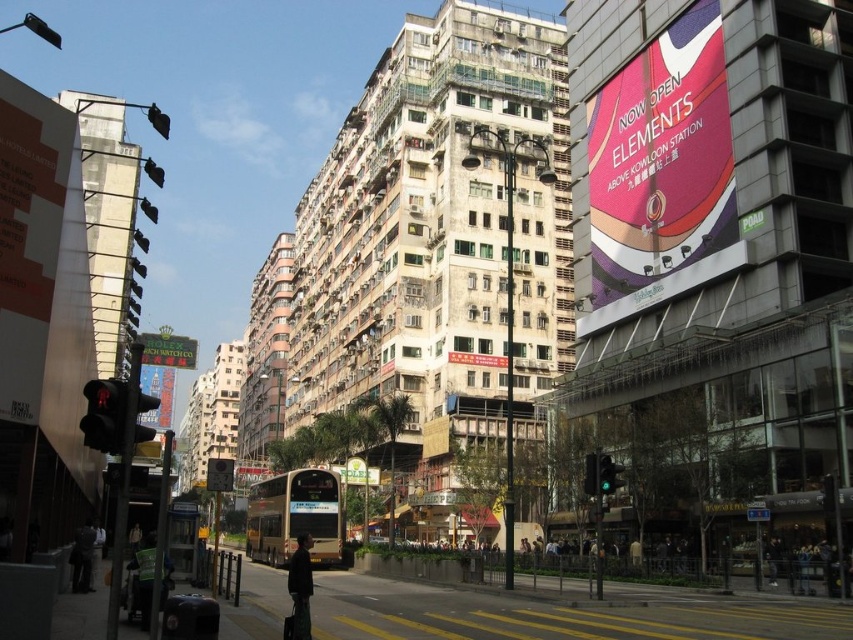
Is matte black traffic light at left above green glass traffic light at center?

Yes.

Is point (86, 424) in front of point (610, 474)?

Yes, it is in front of point (610, 474).

The height and width of the screenshot is (640, 853). Find the location of `matte black traffic light at left`. matte black traffic light at left is located at coordinates (103, 413).

Which is above, matte pink signboard at upper right or metallic gold sign at left?

matte pink signboard at upper right

Can you confirm if matte pink signboard at upper right is positioned above metallic gold sign at left?

Indeed, matte pink signboard at upper right is positioned over metallic gold sign at left.

Where is `matte pink signboard at upper right`? This screenshot has width=853, height=640. matte pink signboard at upper right is located at coordinates (660, 172).

Locate an element on the screen. matte pink signboard at upper right is located at coordinates (660, 172).

Looking at this image, does metallic gold rolex sign at left have a greater height compared to red glossy signboard at center?

Yes.

Is metallic gold rolex sign at left below red glossy signboard at center?

Yes.

Which is in front, point (187, 362) or point (482, 365)?

Point (482, 365) is more forward.

Find the location of a particular element. The height and width of the screenshot is (640, 853). metallic gold rolex sign at left is located at coordinates (167, 349).